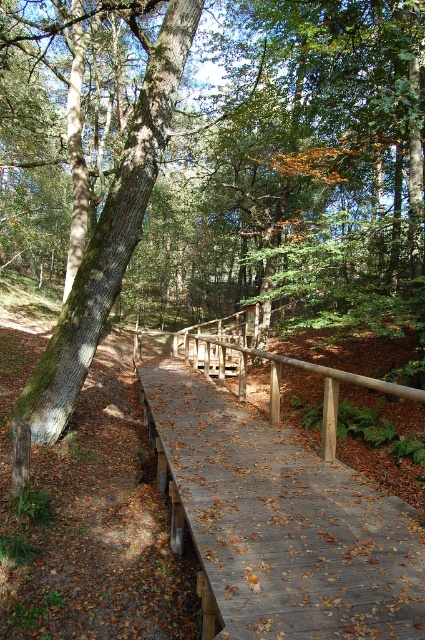
You are standing on the wooden boardwalk in the forest and want to walk towards the point that is closer to you. Which point should you walk towards, point [277,576] or point [130,128]?

You should walk towards point [277,576] because it is closer to the viewer than point [130,128].

You are a hiker who wants to cross the wooden bridge at center but needs to know if it is shorter than the green mossy tree at left. Can you confirm this?

The wooden bridge at center has a lesser height compared to green mossy tree at left, so yes, the wooden bridge at center is shorter than the green mossy tree at left.